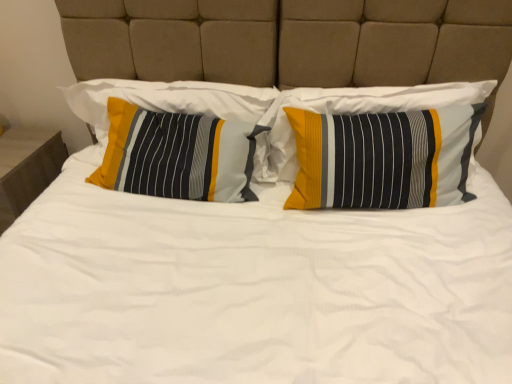
Question: Does matte wood nightstand at left have a greater height compared to textured striped pillow at left, the 2th pillow positioned from the right?

Choices:
 (A) yes
 (B) no

Answer: (A)

Question: Is matte wood nightstand at left thinner than textured striped pillow at left, which is the 2th pillow from left to right?

Choices:
 (A) yes
 (B) no

Answer: (B)

Question: Is matte wood nightstand at left shorter than textured striped pillow at left, the 2th pillow positioned from the right?

Choices:
 (A) no
 (B) yes

Answer: (A)

Question: From a real-world perspective, does matte wood nightstand at left stand above textured striped pillow at left, the 2th pillow positioned from the right?

Choices:
 (A) yes
 (B) no

Answer: (B)

Question: Does matte wood nightstand at left turn towards textured striped pillow at left, which is the 2th pillow from left to right?

Choices:
 (A) yes
 (B) no

Answer: (B)

Question: Is matte wood nightstand at left looking in the opposite direction of textured striped pillow at left, which is the 2th pillow from left to right?

Choices:
 (A) no
 (B) yes

Answer: (A)

Question: Is textured striped pillow at left, the 3th pillow from the right, smaller than textured cotton pillow at center, the third pillow positioned from the left?

Choices:
 (A) no
 (B) yes

Answer: (B)

Question: From the image's perspective, is textured striped pillow at left, marked as the 1th pillow in a left-to-right arrangement, above textured cotton pillow at center, the third pillow positioned from the left?

Choices:
 (A) yes
 (B) no

Answer: (A)

Question: Is textured striped pillow at left, the 3th pillow from the right, bigger than textured cotton pillow at center, placed as the 1th pillow when sorted from right to left?

Choices:
 (A) no
 (B) yes

Answer: (A)

Question: Does textured striped pillow at left, the 3th pillow from the right, have a lesser height compared to textured cotton pillow at center, placed as the 1th pillow when sorted from right to left?

Choices:
 (A) no
 (B) yes

Answer: (B)

Question: From a real-world perspective, does textured striped pillow at left, marked as the 1th pillow in a left-to-right arrangement, sit lower than textured cotton pillow at center, the third pillow positioned from the left?

Choices:
 (A) yes
 (B) no

Answer: (B)

Question: Can you confirm if textured striped pillow at left, marked as the 1th pillow in a left-to-right arrangement, is thinner than textured cotton pillow at center, the third pillow positioned from the left?

Choices:
 (A) yes
 (B) no

Answer: (A)

Question: Does textured striped pillow at left, the 2th pillow positioned from the right, have a greater width compared to matte wood nightstand at left?

Choices:
 (A) yes
 (B) no

Answer: (B)